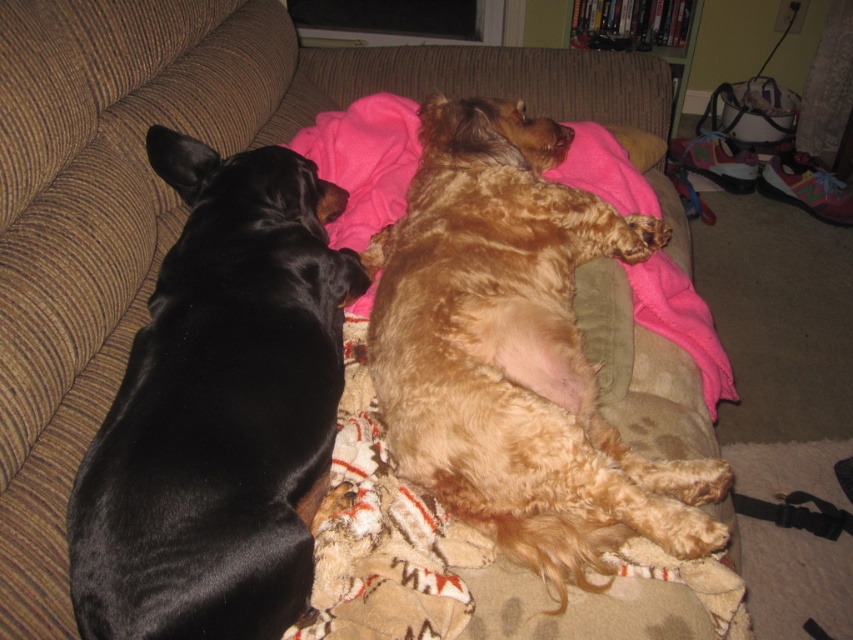
Between point (228, 548) and point (428, 492), which one is positioned in front?

Point (228, 548) is in front.

Locate an element on the screen. The image size is (853, 640). black smooth dog at left is located at coordinates (219, 410).

You are a GUI agent. You are given a task and a screenshot of the screen. Output one action in this format:
    pyautogui.click(x=<x>, y=<y>)
    Task: Click on the black smooth dog at left
    The width and height of the screenshot is (853, 640).
    Given the screenshot: What is the action you would take?
    pyautogui.click(x=219, y=410)

Is golden fur dog at center below fluffy beige blanket at center?

No, golden fur dog at center is not below fluffy beige blanket at center.

Is point (552, 157) farther from camera compared to point (344, 580)?

Yes, it is.

The height and width of the screenshot is (640, 853). Identify the location of golden fur dog at center. (515, 353).

Does black smooth dog at left appear on the right side of fluffy beige blanket at center?

No, black smooth dog at left is not to the right of fluffy beige blanket at center.

Does black smooth dog at left have a larger size compared to fluffy beige blanket at center?

Yes, black smooth dog at left is bigger than fluffy beige blanket at center.

Is point (96, 499) in front of point (459, 534)?

That is True.

This screenshot has height=640, width=853. I want to click on black smooth dog at left, so click(219, 410).